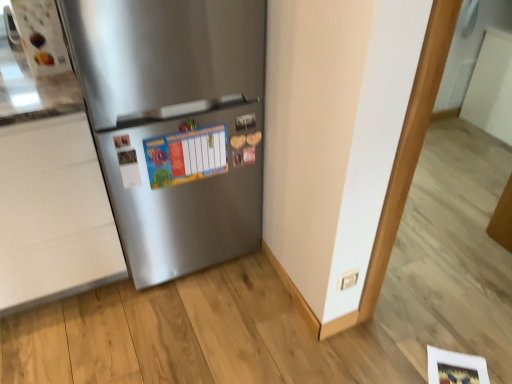
Where is `free space in front of satin silver refrigerator at center`? free space in front of satin silver refrigerator at center is located at coordinates pos(163,330).